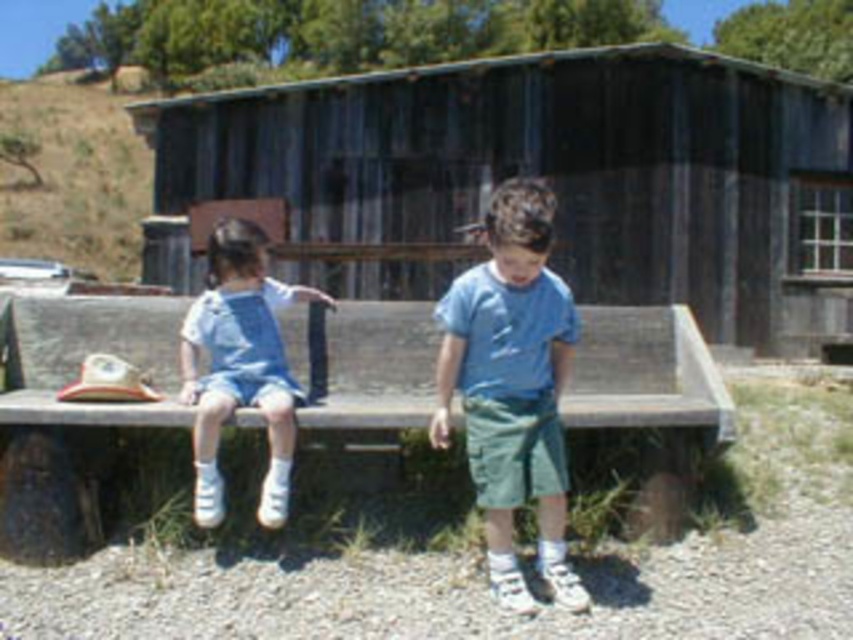
You are a photographer trying to capture both the blue cotton shirt at center and the light blue denim overalls at left in a single shot. Which object should you focus on first to ensure both are in sharp focus?

You should focus on the blue cotton shirt at center first because it is closer to the viewer than the light blue denim overalls at left. By focusing on the closer object, the depth of field may extend to include the farther object in acceptable focus.

You are a tailor who needs to know the clothing sizes of the children in the image. Which clothing item has a smaller width between the blue cotton shirt at center and the light blue denim overalls at left?

The blue cotton shirt at center has a smaller width than the light blue denim overalls at left.

You are trying to determine if the weathered wood hut at center can fit the blue cotton shirt at center inside it. Based on their sizes, is this possible?

The weathered wood hut at center might be wider than blue cotton shirt at center, so it is possible that the blue cotton shirt at center can fit inside the weathered wood hut at center.